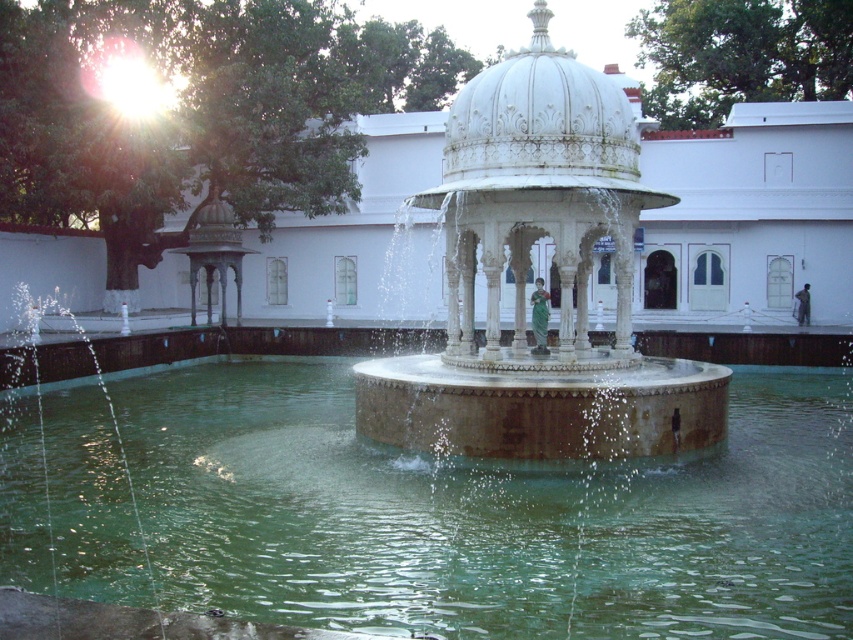
Question: Estimate the real-world distances between objects in this image. Which object is closer to the white marble dome at center?

Choices:
 (A) white marble fountain at center
 (B) green marble gazebo at left

Answer: (A)

Question: Is green marble gazebo at left positioned before dark gray fabric bag at center?

Choices:
 (A) no
 (B) yes

Answer: (B)

Question: Can you confirm if white marble fountain at center is positioned below green fabric statue at center?

Choices:
 (A) no
 (B) yes

Answer: (A)

Question: Among these points, which one is nearest to the camera?

Choices:
 (A) (538, 321)
 (B) (517, 157)
 (C) (543, 52)

Answer: (B)

Question: Does green stone water at center appear on the right side of green fabric statue at center?

Choices:
 (A) no
 (B) yes

Answer: (B)

Question: Among these objects, which one is nearest to the camera?

Choices:
 (A) dark gray fabric bag at center
 (B) white marble dome at center

Answer: (B)